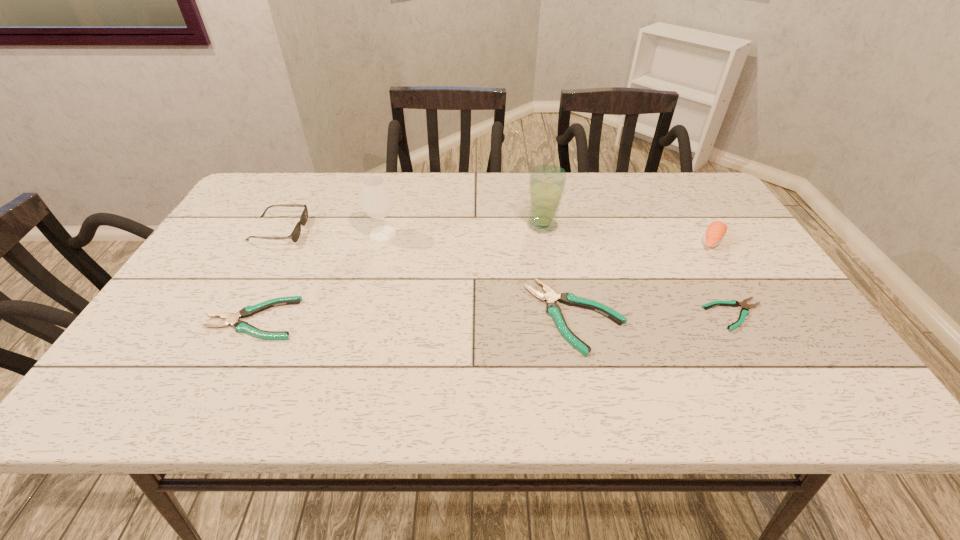
Locate an element on the screen. The image size is (960, 540). location for an additional pliers to make spacing equal is located at coordinates (415, 318).